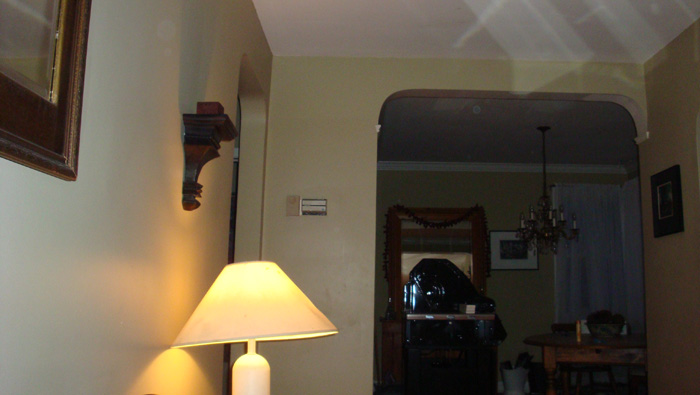
The width and height of the screenshot is (700, 395). In order to click on shelf in this screenshot , I will do `click(217, 148)`.